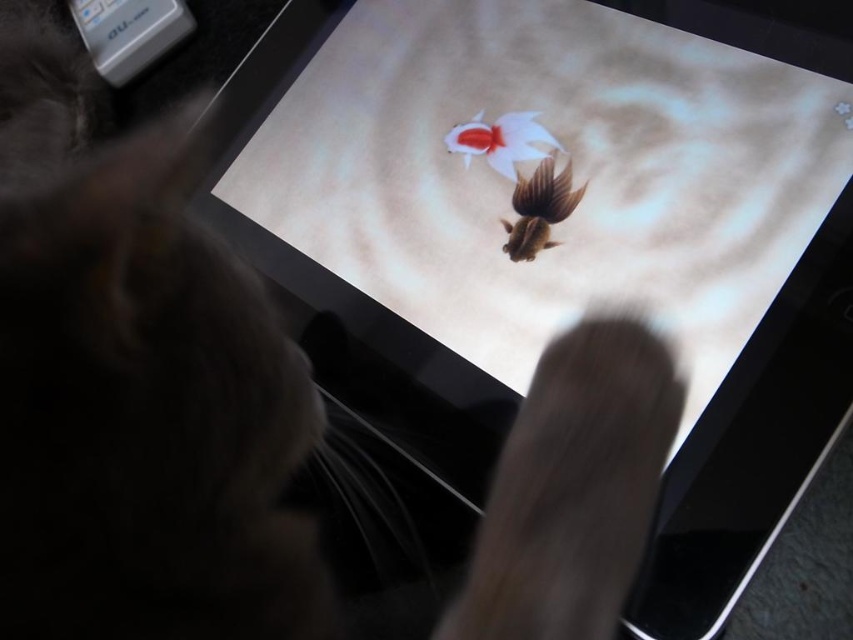
Who is more forward, [555,189] or [541,148]?

Point [555,189]

Locate an element on the screen. shiny brown fish at center is located at coordinates pyautogui.click(x=538, y=209).

The width and height of the screenshot is (853, 640). I want to click on shiny brown fish at center, so click(x=538, y=209).